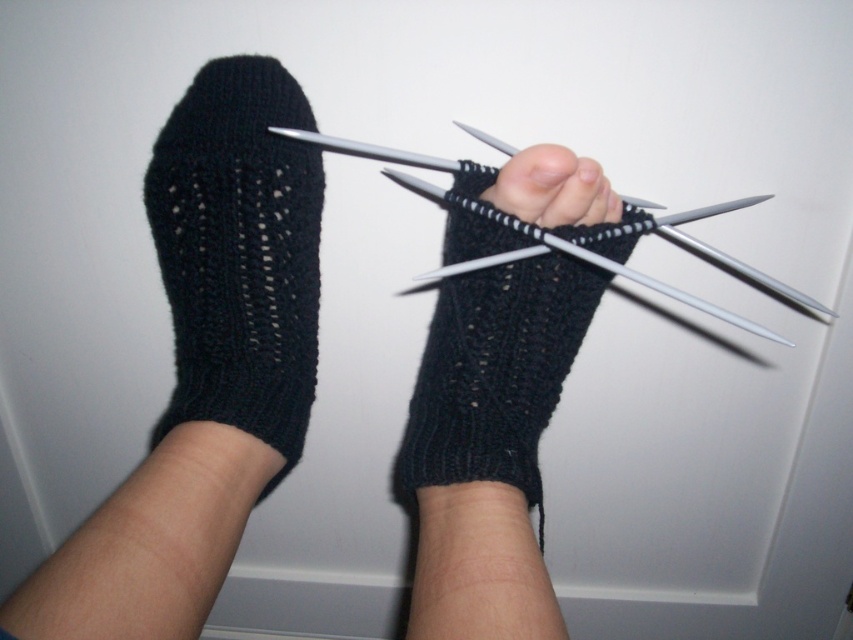
Question: Is metallic silver knitting needles at center smaller than matte black sock at center?

Choices:
 (A) yes
 (B) no

Answer: (B)

Question: Based on their relative distances, which object is nearer to the matte black sock at center?

Choices:
 (A) metallic silver knitting needles at center
 (B) black knitted glove at center
 (C) black knitted sock at left
 (D) black knitted socks at center

Answer: (A)

Question: Among these points, which one is nearest to the camera?

Choices:
 (A) coord(616,200)
 (B) coord(119,573)
 (C) coord(543,244)
 (D) coord(213,323)

Answer: (B)

Question: Is black knitted socks at center wider than black knitted sock at left?

Choices:
 (A) yes
 (B) no

Answer: (A)

Question: Considering the real-world distances, which object is closest to the metallic silver knitting needles at center?

Choices:
 (A) black knitted socks at center
 (B) matte black sock at center

Answer: (B)

Question: Does metallic silver knitting needles at center have a smaller size compared to matte black sock at center?

Choices:
 (A) yes
 (B) no

Answer: (B)